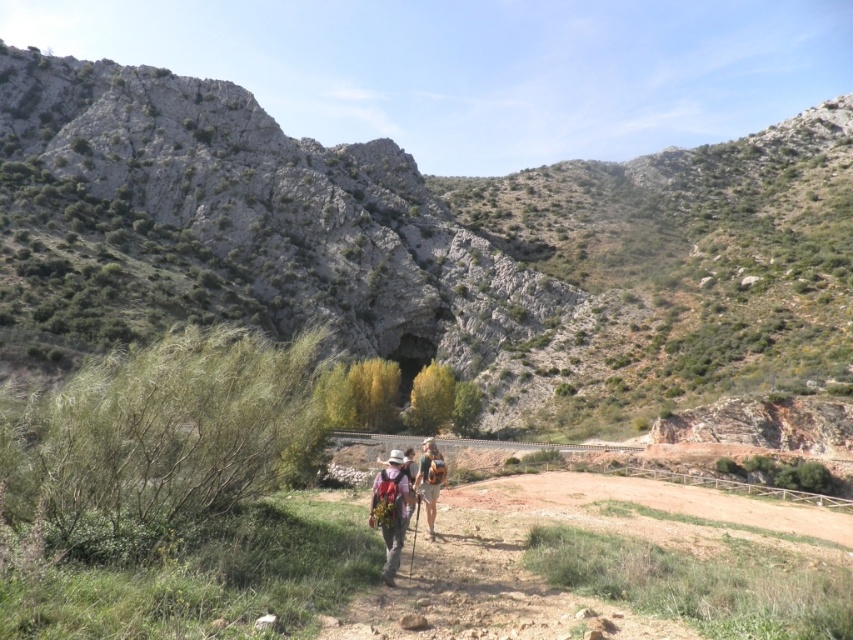
Question: Does rocky at center have a lesser width compared to matte pink backpack at center?

Choices:
 (A) yes
 (B) no

Answer: (B)

Question: Which of the following is the farthest from the observer?

Choices:
 (A) (97, 214)
 (B) (427, 504)

Answer: (A)

Question: From the image, what is the correct spatial relationship of rocky at center in relation to matte pink backpack at center?

Choices:
 (A) above
 (B) below

Answer: (A)

Question: Which of these objects is positioned farthest from the rocky at center?

Choices:
 (A) camouflage fabric backpack at center
 (B) matte pink backpack at center

Answer: (B)

Question: Can you confirm if rocky at center is wider than matte pink backpack at center?

Choices:
 (A) no
 (B) yes

Answer: (B)

Question: Estimate the real-world distances between objects in this image. Which object is closer to the matte pink backpack at center?

Choices:
 (A) camouflage fabric backpack at center
 (B) rocky at center

Answer: (A)